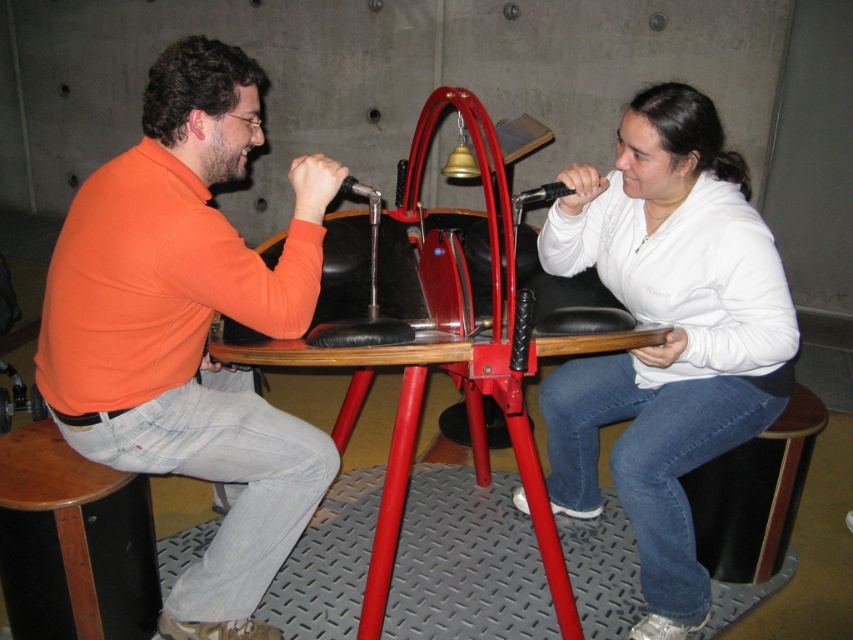
Question: Is orange cotton shirt at left further to camera compared to white fleece at center?

Choices:
 (A) yes
 (B) no

Answer: (B)

Question: Is orange cotton shirt at left above white fleece at center?

Choices:
 (A) yes
 (B) no

Answer: (B)

Question: Which point is closer to the camera taking this photo?

Choices:
 (A) (616, 419)
 (B) (157, 150)

Answer: (B)

Question: Among these objects, which one is nearest to the camera?

Choices:
 (A) white fleece at center
 (B) orange cotton shirt at left

Answer: (B)

Question: Is orange cotton shirt at left below white fleece at center?

Choices:
 (A) no
 (B) yes

Answer: (B)

Question: Which point is closer to the camera?

Choices:
 (A) white fleece at center
 (B) orange cotton shirt at left

Answer: (B)